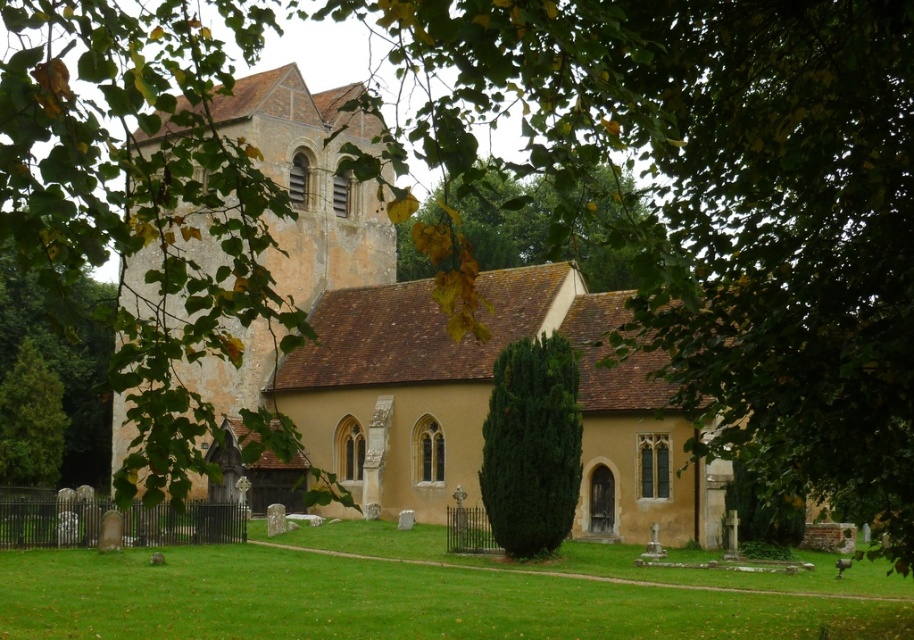
Question: Is the position of green leafy tree at center more distant than that of green leafy tree at upper left?

Choices:
 (A) no
 (B) yes

Answer: (B)

Question: Does yellow stone church at center come in front of green leafy tree at center?

Choices:
 (A) yes
 (B) no

Answer: (B)

Question: From the image, what is the correct spatial relationship of yellow stone church at center in relation to green textured bush at center?

Choices:
 (A) left
 (B) right

Answer: (A)

Question: Among these objects, which one is nearest to the camera?

Choices:
 (A) green textured tree at lower left
 (B) green leafy tree at center
 (C) green leafy tree at upper left
 (D) yellow stone church at center

Answer: (C)

Question: Which object appears closest to the camera in this image?

Choices:
 (A) yellow stone church at center
 (B) green textured tree at lower left
 (C) green leafy tree at center
 (D) green leafy tree at upper left

Answer: (D)

Question: Which object is closer to the camera taking this photo?

Choices:
 (A) green leafy tree at center
 (B) green textured bush at center
 (C) yellow stone church at center

Answer: (A)